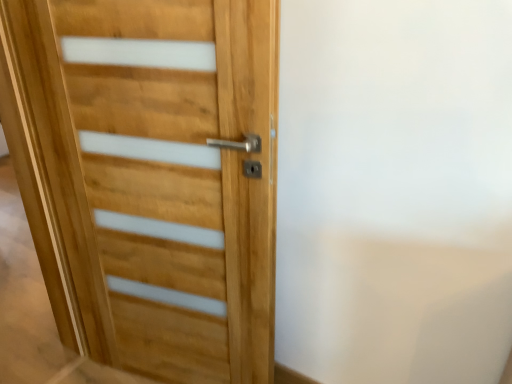
Identify the location of natural wood door at center. (164, 178).

What is the approximate height of natural wood door at center?

4.86 feet.

The width and height of the screenshot is (512, 384). What do you see at coordinates (164, 178) in the screenshot?
I see `natural wood door at center` at bounding box center [164, 178].

Locate an element on the screen. This screenshot has height=384, width=512. natural wood door at center is located at coordinates (164, 178).